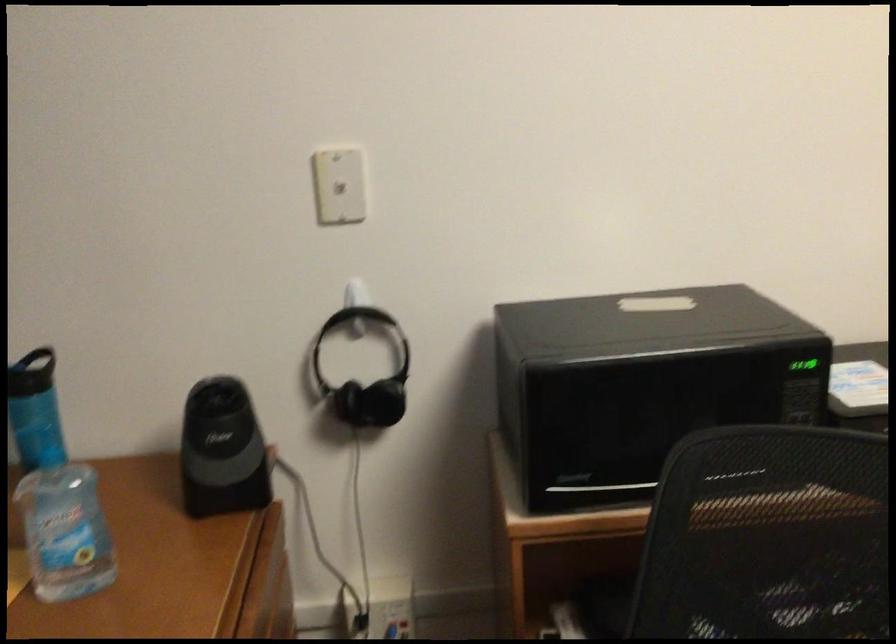
The width and height of the screenshot is (896, 644). Find the location of `microwave top handle`. microwave top handle is located at coordinates (657, 301).